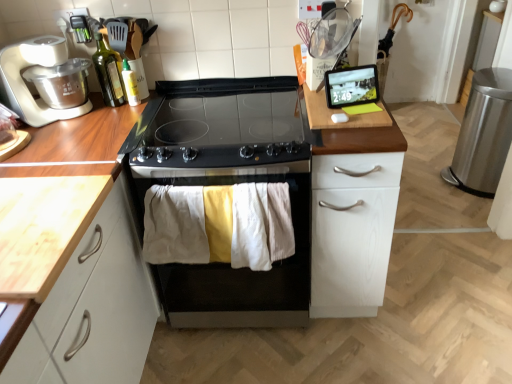
Question: Is white matte food processor at left at the right side of black stainless steel oven at center?

Choices:
 (A) yes
 (B) no

Answer: (B)

Question: Would you say black stainless steel oven at center is part of white matte food processor at left's contents?

Choices:
 (A) yes
 (B) no

Answer: (B)

Question: Is white matte food processor at left directly adjacent to black stainless steel oven at center?

Choices:
 (A) yes
 (B) no

Answer: (B)

Question: Is white matte food processor at left turned away from black stainless steel oven at center?

Choices:
 (A) no
 (B) yes

Answer: (A)

Question: Is white matte food processor at left facing towards black stainless steel oven at center?

Choices:
 (A) yes
 (B) no

Answer: (B)

Question: Considering their positions, is white matte food processor at left located in front of or behind white matte cabinet at right?

Choices:
 (A) behind
 (B) front

Answer: (A)

Question: From a real-world perspective, relative to white matte cabinet at right, is white matte food processor at left vertically above or below?

Choices:
 (A) below
 (B) above

Answer: (B)

Question: Considering the relative positions of white matte food processor at left and white matte cabinet at right in the image provided, is white matte food processor at left to the left or to the right of white matte cabinet at right?

Choices:
 (A) left
 (B) right

Answer: (A)

Question: Considering the positions of white matte food processor at left and white matte cabinet at right in the image, is white matte food processor at left taller or shorter than white matte cabinet at right?

Choices:
 (A) short
 (B) tall

Answer: (A)

Question: In terms of width, does green glass bottle at upper left, the 2th bottle positioned from the right, look wider or thinner when compared to light wood countertop at left?

Choices:
 (A) wide
 (B) thin

Answer: (B)

Question: From their relative heights in the image, would you say green glass bottle at upper left, the 2th bottle positioned from the right, is taller or shorter than light wood countertop at left?

Choices:
 (A) tall
 (B) short

Answer: (A)

Question: From a real-world perspective, relative to light wood countertop at left, is green glass bottle at upper left, the 2th bottle positioned from the right, vertically above or below?

Choices:
 (A) below
 (B) above

Answer: (B)

Question: From the image's perspective, is green glass bottle at upper left, the 2th bottle positioned from the right, positioned above or below light wood countertop at left?

Choices:
 (A) above
 (B) below

Answer: (A)

Question: Is white matte food processor at left spatially inside light wood countertop at left, or outside of it?

Choices:
 (A) outside
 (B) inside

Answer: (A)

Question: Considering the positions of point (47, 61) and point (45, 210), is point (47, 61) closer or farther from the camera than point (45, 210)?

Choices:
 (A) closer
 (B) farther

Answer: (B)